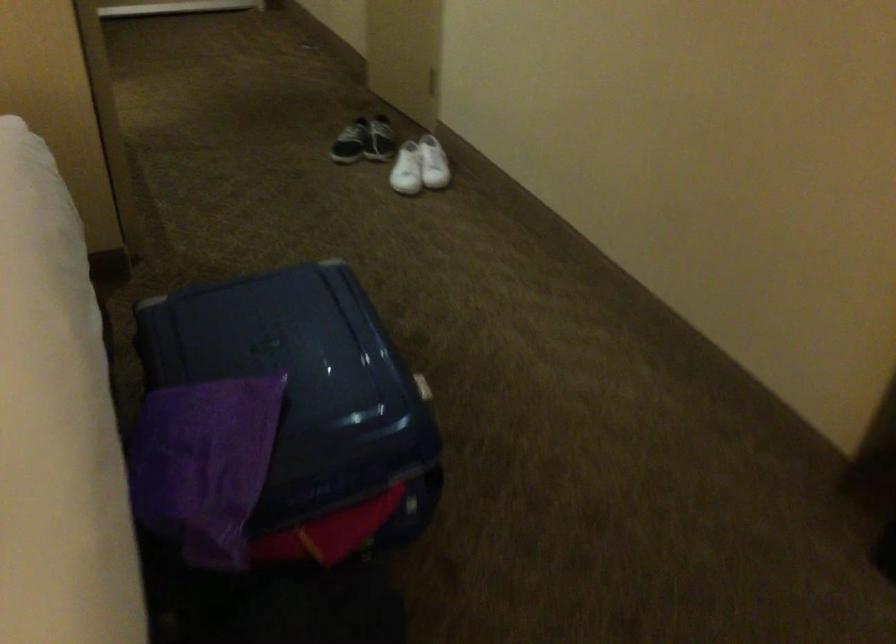
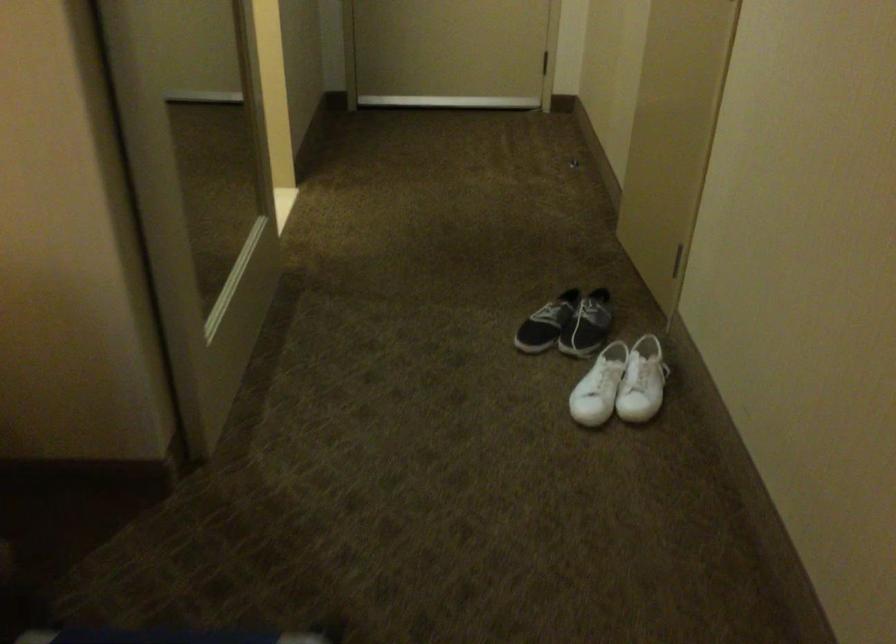
Where in the second image is the point corresponding to point (408, 167) from the first image?

(599, 386)